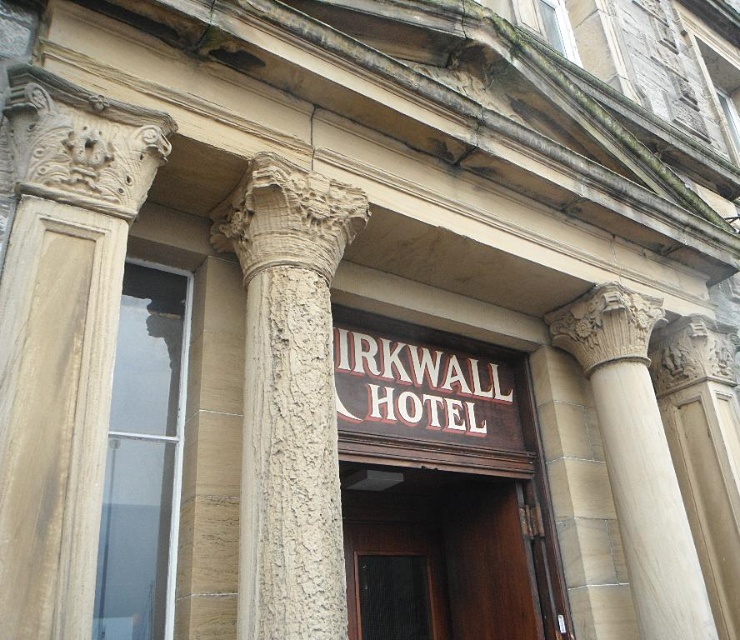
Looking at this image, is beige stone column at left smaller than beige stone column at center?

Indeed, beige stone column at left has a smaller size compared to beige stone column at center.

Between beige stone column at left and beige stone column at center, which one is positioned lower?

beige stone column at center is below.

Does point (74, 388) come farther from viewer compared to point (576, 340)?

No, it is not.

This screenshot has height=640, width=740. In order to click on beige stone column at left in this screenshot , I will do `click(61, 337)`.

Does speckled stone column at center appear on the right side of beige stone column at center?

In fact, speckled stone column at center is to the left of beige stone column at center.

Who is taller, speckled stone column at center or beige stone column at center?

beige stone column at center is taller.

Does point (269, 173) come behind point (630, 324)?

No, it is in front of (630, 324).

This screenshot has width=740, height=640. Find the location of `speckled stone column at center`. speckled stone column at center is located at coordinates pyautogui.click(x=289, y=396).

What do you see at coordinates (289, 396) in the screenshot? I see `speckled stone column at center` at bounding box center [289, 396].

Between speckled stone column at center and brown wooden door at center, which one is positioned lower?

brown wooden door at center

Does point (269, 477) come behind point (468, 481)?

No, it is in front of (468, 481).

Where is `speckled stone column at center`? The image size is (740, 640). speckled stone column at center is located at coordinates (289, 396).